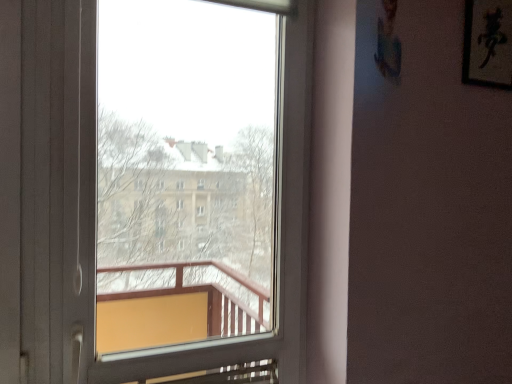
Question: Can you confirm if transparent glass window at center is taller than black paper at upper right?

Choices:
 (A) no
 (B) yes

Answer: (B)

Question: Is there a large distance between transparent glass window at center and black paper at upper right?

Choices:
 (A) yes
 (B) no

Answer: (B)

Question: From a real-world perspective, is transparent glass window at center located higher than black paper at upper right?

Choices:
 (A) no
 (B) yes

Answer: (A)

Question: Does transparent glass window at center appear on the left side of black paper at upper right?

Choices:
 (A) yes
 (B) no

Answer: (A)

Question: Can you confirm if transparent glass window at center is shorter than black paper at upper right?

Choices:
 (A) no
 (B) yes

Answer: (A)

Question: Is transparent glass window at center directly adjacent to black paper at upper right?

Choices:
 (A) yes
 (B) no

Answer: (B)

Question: Would you say black paper at upper right is outside transparent glass window at center?

Choices:
 (A) no
 (B) yes

Answer: (B)

Question: From a real-world perspective, is black paper at upper right on transparent glass window at center?

Choices:
 (A) yes
 (B) no

Answer: (A)

Question: Are black paper at upper right and transparent glass window at center far apart?

Choices:
 (A) yes
 (B) no

Answer: (B)

Question: Is black paper at upper right in front of transparent glass window at center?

Choices:
 (A) no
 (B) yes

Answer: (A)

Question: Is transparent glass window at center located within black paper at upper right?

Choices:
 (A) yes
 (B) no

Answer: (B)

Question: Can you confirm if black paper at upper right is positioned to the right of transparent glass window at center?

Choices:
 (A) yes
 (B) no

Answer: (A)

Question: From a real-world perspective, is transparent glass window at center above or below black paper at upper right?

Choices:
 (A) above
 (B) below

Answer: (B)